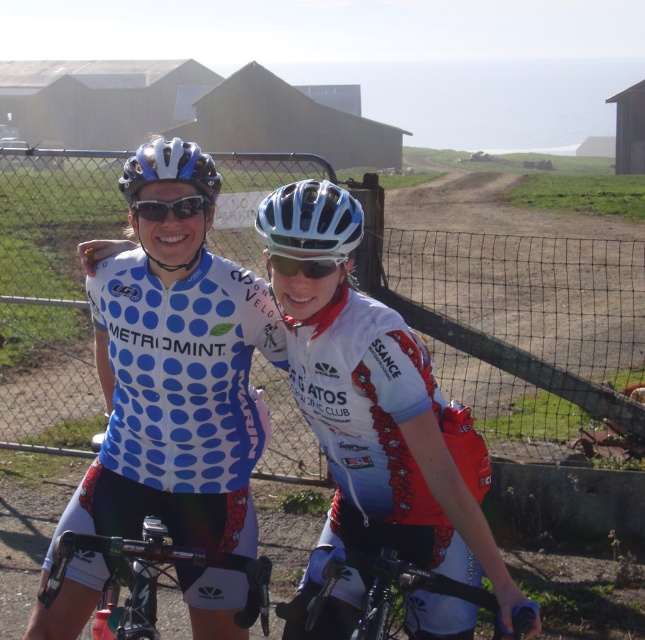
Question: Which point is closer to the camera taking this photo?

Choices:
 (A) (195, 168)
 (B) (412, 573)
 (C) (86, 323)

Answer: (B)

Question: Is shiny black bicycle at center above shiny black handlebars at center?

Choices:
 (A) yes
 (B) no

Answer: (B)

Question: Which of these objects is positioned closest to the white jersey at center?

Choices:
 (A) shiny black bicycle at center
 (B) blue reflective lens goggles at center

Answer: (A)

Question: Which point appears farthest from the camera in this image?

Choices:
 (A) (350, 552)
 (B) (97, 150)

Answer: (B)

Question: Is white glossy bicycle helmet at center wider than matte blue helmet at center?

Choices:
 (A) no
 (B) yes

Answer: (A)

Question: Does metal mesh fence at center have a smaller size compared to shiny black bicycle at center?

Choices:
 (A) no
 (B) yes

Answer: (A)